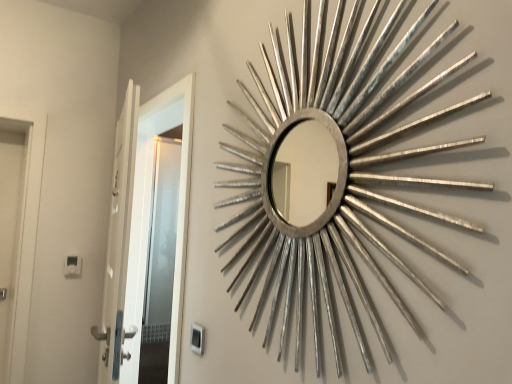
You are a GUI agent. You are given a task and a screenshot of the screen. Output one action in this format:
    pyautogui.click(x=<x>, y=<y>)
    Task: Click on the white glossy door at left
    This screenshot has width=512, height=384.
    Given the screenshot: What is the action you would take?
    pyautogui.click(x=142, y=226)

This screenshot has height=384, width=512. What do you see at coordinates (142, 226) in the screenshot?
I see `white glossy door at left` at bounding box center [142, 226].

This screenshot has height=384, width=512. Describe the element at coordinates (336, 177) in the screenshot. I see `silver metallic sunburst mirror at upper right` at that location.

Find the location of a particular element. silver metallic sunburst mirror at upper right is located at coordinates (336, 177).

This screenshot has width=512, height=384. I want to click on white glossy door at left, so click(x=142, y=226).

Which is more to the left, white glossy door at left or silver metallic sunburst mirror at upper right?

From the viewer's perspective, white glossy door at left appears more on the left side.

Does white glossy door at left lie behind silver metallic sunburst mirror at upper right?

Yes, it is behind silver metallic sunburst mirror at upper right.

Which is behind, point (129, 326) or point (305, 119)?

The point (129, 326) is farther.

From the image's perspective, does white glossy door at left appear lower than silver metallic sunburst mirror at upper right?

Yes, from the image's perspective, white glossy door at left is beneath silver metallic sunburst mirror at upper right.

From a real-world perspective, which is physically below, white glossy door at left or silver metallic sunburst mirror at upper right?

white glossy door at left is physically lower.

In terms of width, does white glossy door at left look wider or thinner when compared to silver metallic sunburst mirror at upper right?

white glossy door at left is wider than silver metallic sunburst mirror at upper right.

Is white glossy door at left taller than silver metallic sunburst mirror at upper right?

Yes.

Is white glossy door at left bigger than silver metallic sunburst mirror at upper right?

Correct, white glossy door at left is larger in size than silver metallic sunburst mirror at upper right.

From the picture: Is white glossy door at left inside or outside of silver metallic sunburst mirror at upper right?

white glossy door at left is not inside silver metallic sunburst mirror at upper right, it's outside.

Is white glossy door at left with silver metallic sunburst mirror at upper right?

No.

Is white glossy door at left turned away from silver metallic sunburst mirror at upper right?

No, silver metallic sunburst mirror at upper right is not at the back of white glossy door at left.

How far apart are white glossy door at left and silver metallic sunburst mirror at upper right?

A distance of 29.65 inches exists between white glossy door at left and silver metallic sunburst mirror at upper right.

You are a GUI agent. You are given a task and a screenshot of the screen. Output one action in this format:
    pyautogui.click(x=<x>, y=<y>)
    Task: Click on the door located on the left of silver metallic sunburst mirror at upper right
    This screenshot has width=512, height=384.
    Given the screenshot: What is the action you would take?
    pyautogui.click(x=142, y=226)

Which object is positioned more to the left, silver metallic sunburst mirror at upper right or white glossy door at left?

From the viewer's perspective, white glossy door at left appears more on the left side.

Which object is closer to the camera taking this photo, silver metallic sunburst mirror at upper right or white glossy door at left?

silver metallic sunburst mirror at upper right is in front.

Considering the points (400, 182) and (169, 122), which point is behind, point (400, 182) or point (169, 122)?

The point (169, 122) is more distant.

From the image's perspective, is silver metallic sunburst mirror at upper right positioned above or below white glossy door at left?

Based on their image positions, silver metallic sunburst mirror at upper right is located above white glossy door at left.

From a real-world perspective, between silver metallic sunburst mirror at upper right and white glossy door at left, who is vertically lower?

white glossy door at left.

Considering the relative sizes of silver metallic sunburst mirror at upper right and white glossy door at left in the image provided, is silver metallic sunburst mirror at upper right wider than white glossy door at left?

Incorrect, the width of silver metallic sunburst mirror at upper right does not surpass that of white glossy door at left.

Is silver metallic sunburst mirror at upper right shorter than white glossy door at left?

Indeed, silver metallic sunburst mirror at upper right has a lesser height compared to white glossy door at left.

Who is bigger, silver metallic sunburst mirror at upper right or white glossy door at left?

white glossy door at left is bigger.

Is silver metallic sunburst mirror at upper right inside or outside of white glossy door at left?

silver metallic sunburst mirror at upper right is located beyond the bounds of white glossy door at left.

In the scene shown: Would you consider silver metallic sunburst mirror at upper right to be distant from white glossy door at left?

No, there isn't a large distance between silver metallic sunburst mirror at upper right and white glossy door at left.

Is silver metallic sunburst mirror at upper right oriented towards white glossy door at left?

No, silver metallic sunburst mirror at upper right is not aimed at white glossy door at left.

What's the angular difference between silver metallic sunburst mirror at upper right and white glossy door at left's facing directions?

0.0103 degrees.

Identify the location of door on the left of silver metallic sunburst mirror at upper right. The height and width of the screenshot is (384, 512). (142, 226).

The image size is (512, 384). I want to click on brass above the white glossy door at left (from a real-world perspective), so click(336, 177).

You are a GUI agent. You are given a task and a screenshot of the screen. Output one action in this format:
    pyautogui.click(x=<x>, y=<y>)
    Task: Click on the brass in front of the white glossy door at left
    
    Given the screenshot: What is the action you would take?
    pyautogui.click(x=336, y=177)